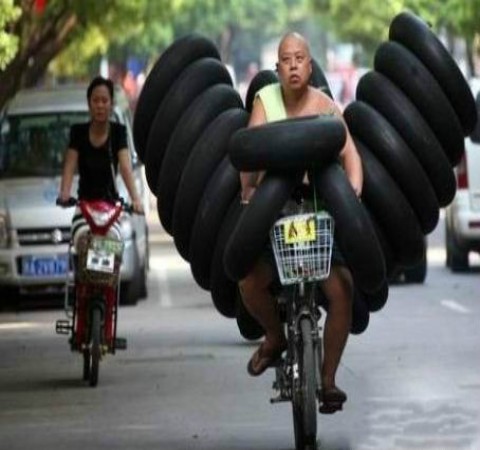
At what (x,y) coordinates should I click in order to perform the action: click on hood. Please return your answer as a coordinate pair (x, y). Looking at the image, I should click on (30, 198).